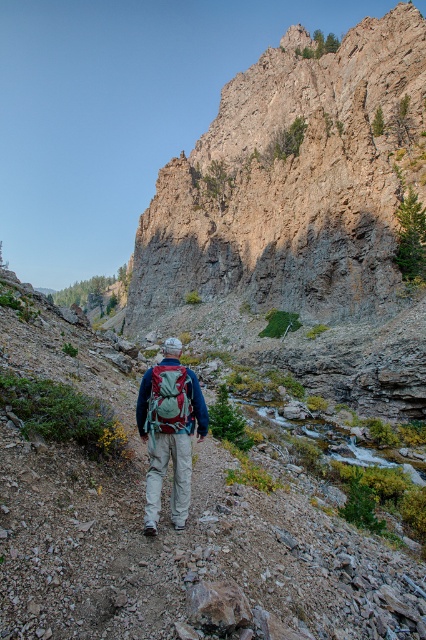
Is point (187, 480) less distant than point (192, 422)?

Yes, it is in front of point (192, 422).

From the picture: Is matte green backpack at center shorter than teal fabric backpack at center?

In fact, matte green backpack at center may be taller than teal fabric backpack at center.

Is point (167, 340) positioned in front of point (181, 376)?

No, (167, 340) is behind (181, 376).

Identify the location of matte green backpack at center. The height and width of the screenshot is (640, 426). (169, 432).

Does rugged stone cliff at upper center have a greater height compared to teal fabric backpack at center?

Yes.

Is point (258, 209) closer to camera compared to point (178, 365)?

No, it is behind (178, 365).

Does point (284, 120) come closer to viewer compared to point (167, 406)?

No, (284, 120) is further to viewer.

Identify the location of rugged stone cliff at upper center. point(293,180).

Does rugged stone cliff at upper center appear over matte green backpack at center?

Correct, rugged stone cliff at upper center is located above matte green backpack at center.

Which of these two, rugged stone cliff at upper center or matte green backpack at center, stands shorter?

matte green backpack at center is shorter.

Is point (322, 160) in front of point (158, 381)?

No, it is not.

Where is `rugged stone cliff at upper center`? rugged stone cliff at upper center is located at coordinates (293, 180).